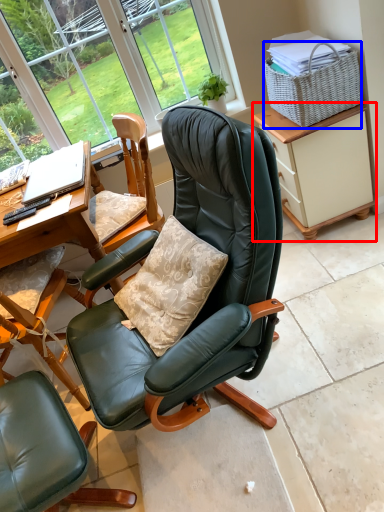
Question: Which object appears farthest to the camera in this image, cabinetry (highlighted by a red box) or picnic basket (highlighted by a blue box)?

Choices:
 (A) cabinetry
 (B) picnic basket

Answer: (A)